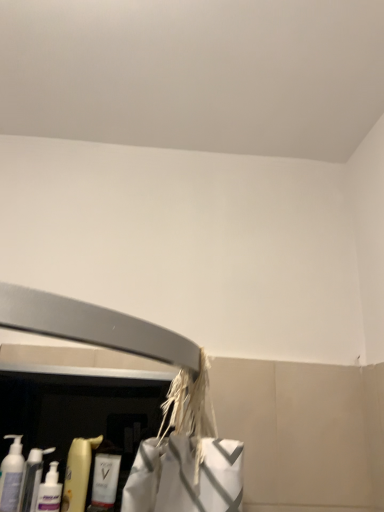
Question: Considering the positions of translucent plastic bottles at lower left, acting as the third cleaning product starting from the right, and translucent plastic bottle at lower left, the 2th cleaning product from the right, in the image, is translucent plastic bottles at lower left, acting as the third cleaning product starting from the right, taller or shorter than translucent plastic bottle at lower left, the 2th cleaning product from the right,?

Choices:
 (A) short
 (B) tall

Answer: (A)

Question: From the image's perspective, is translucent plastic bottles at lower left, which is the 2th cleaning product from left to right, located above or below translucent plastic bottle at lower left, which is counted as the 3th cleaning product, starting from the left?

Choices:
 (A) below
 (B) above

Answer: (A)

Question: Estimate the real-world distances between objects in this image. Which object is farther from the translucent plastic pump bottle at lower left, the fourth cleaning product when ordered from right to left?

Choices:
 (A) translucent plastic bottles at lower left, acting as the third cleaning product starting from the right
 (B) white glossy bottle at lower left, which is the 1th cleaning product from right to left
 (C) translucent plastic bottle at lower left, the 2th cleaning product from the right

Answer: (B)

Question: Which object is positioned farthest from the translucent plastic bottle at lower left, which is counted as the 3th cleaning product, starting from the left?

Choices:
 (A) white glossy bottle at lower left, which is the 1th cleaning product from right to left
 (B) translucent plastic bottles at lower left, acting as the third cleaning product starting from the right
 (C) translucent plastic pump bottle at lower left, arranged as the first cleaning product when viewed from the left

Answer: (C)